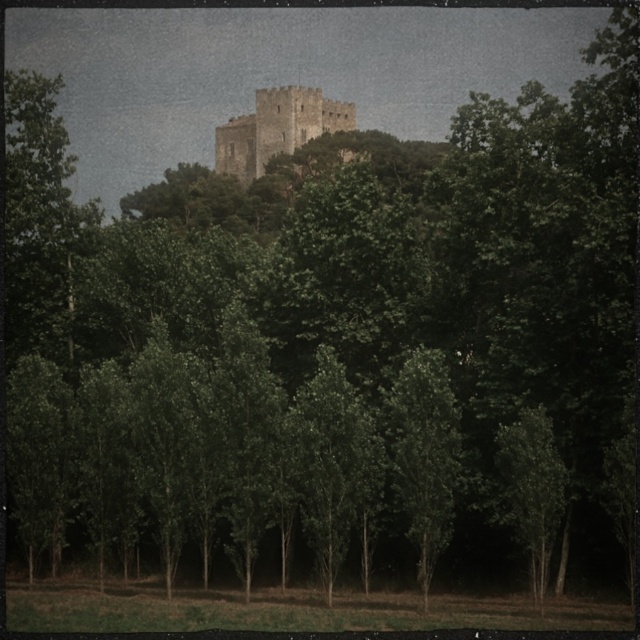
You are a hiker standing at the base of the hill looking towards the light beige stone castle at center. You notice a green leafy tree at lower right. Which object is located to the right of the castle?

The green leafy tree at lower right is positioned on the right side of light beige stone castle at center.

You are a hiker standing at the base of the hill looking towards the light beige stone castle at center. You notice a green leafy tree at lower right. Which object is closer to you, the hiker?

The green leafy tree at lower right is closer to you since it is positioned under the light beige stone castle at center, which is further away on the hill.

You are a bird flying over the landscape and want to land on the highest point between the green leafy tree at lower right and the light beige stone castle at center. Which one should you choose?

The light beige stone castle at center is taller than the green leafy tree at lower right, so you should land on the light beige stone castle at center.